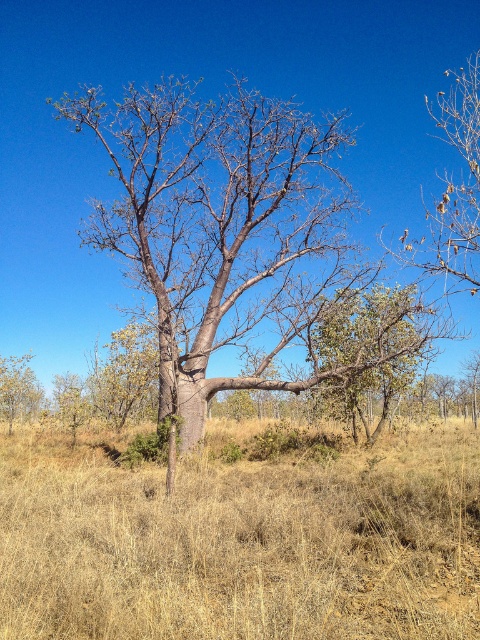
Is bark-like textured tree at center taller than green leafy tree at left?

Indeed, bark-like textured tree at center has a greater height compared to green leafy tree at left.

Can you confirm if bark-like textured tree at center is positioned to the left of green leafy tree at left?

No, bark-like textured tree at center is not to the left of green leafy tree at left.

Identify the location of bark-like textured tree at center. Image resolution: width=480 pixels, height=640 pixels. (224, 230).

Identify the location of bark-like textured tree at center. The width and height of the screenshot is (480, 640). (224, 230).

Between bare branches at upper right and green leafy tree at left, which one is positioned higher?

A: bare branches at upper right is higher up.

Does bare branches at upper right have a greater height compared to green leafy tree at left?

Indeed, bare branches at upper right has a greater height compared to green leafy tree at left.

At what (x,y) coordinates should I click in order to perform the action: click on bare branches at upper right. Please return your answer as a coordinate pair (x, y). Looking at the image, I should click on (454, 188).

Where is `bare branches at upper right`? bare branches at upper right is located at coordinates (454, 188).

Can you confirm if bark-like textured tree at center is taller than bare branches at upper right?

Correct, bark-like textured tree at center is much taller as bare branches at upper right.

Does point (158, 152) come closer to viewer compared to point (471, 285)?

No, (158, 152) is further to viewer.

The height and width of the screenshot is (640, 480). Find the location of `bark-like textured tree at center`. bark-like textured tree at center is located at coordinates (224, 230).